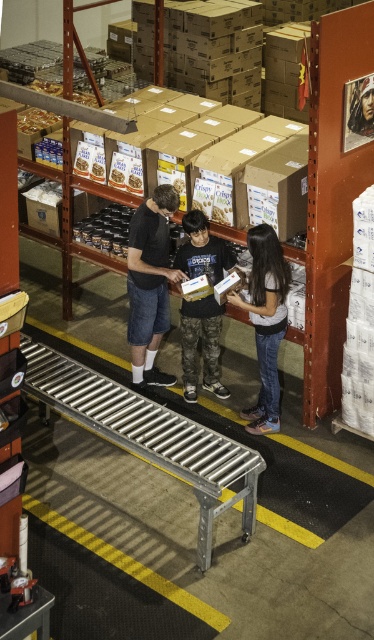
Is point (139, 346) closer to camera compared to point (200, 272)?

No, it is behind (200, 272).

Find the location of a particular element. The image size is (374, 640). denim shorts at center is located at coordinates (149, 284).

Is denim jeans at center above camouflage pants at center?

No, denim jeans at center is not above camouflage pants at center.

Which is in front, point (264, 292) or point (201, 243)?

Point (264, 292) is in front.

Who is more forward, [262,275] or [194,312]?

Point [262,275] is in front.

At what (x,y) coordinates should I click in order to perform the action: click on denim jeans at center. Please return your answer as a coordinate pair (x, y). The width and height of the screenshot is (374, 640). Looking at the image, I should click on (265, 321).

Between point (154, 260) and point (249, 243), which one is positioned in front?

Positioned in front is point (249, 243).

This screenshot has height=640, width=374. What do you see at coordinates (149, 284) in the screenshot?
I see `denim shorts at center` at bounding box center [149, 284].

The height and width of the screenshot is (640, 374). I want to click on denim shorts at center, so click(x=149, y=284).